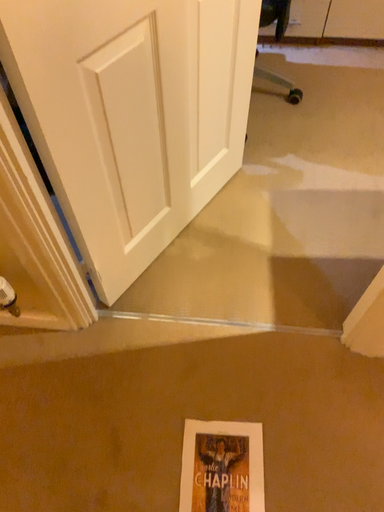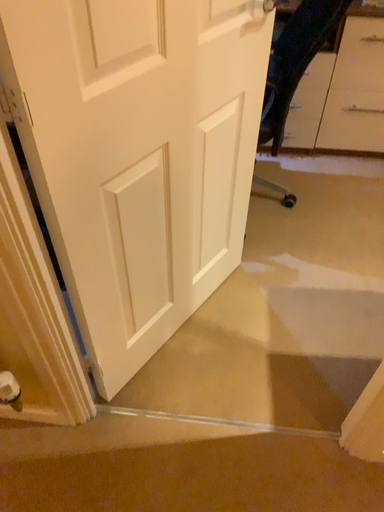
Question: How did the camera likely rotate when shooting the video?

Choices:
 (A) rotated upward
 (B) rotated downward

Answer: (A)